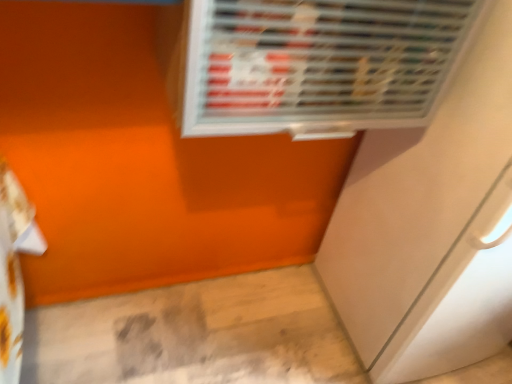
This screenshot has height=384, width=512. What are the coordinates of `free space that is to the left of white glossy screen door at lower right` in the screenshot? It's located at (278, 317).